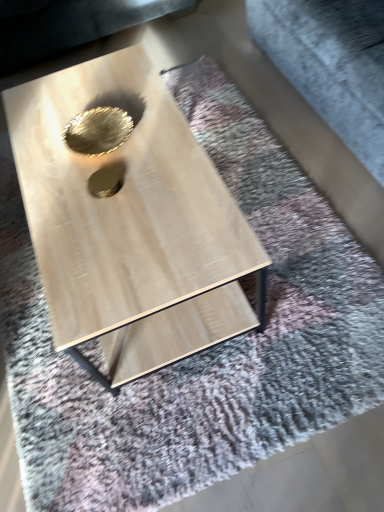
You are a GUI agent. You are given a task and a screenshot of the screen. Output one action in this format:
    pyautogui.click(x=<x>, y=<y>)
    Task: Click on the spots to the right of gold metallic hole at center, which appears as the 1th hole when viewed from the back
    The height and width of the screenshot is (512, 384).
    Given the screenshot: What is the action you would take?
    pyautogui.click(x=158, y=128)